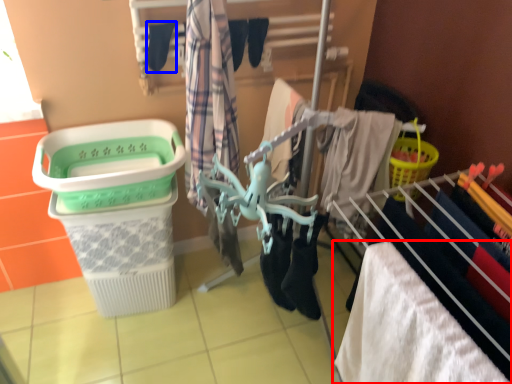
Question: Which object appears closest to the camera in this image, towel (highlighted by a red box) or clothing (highlighted by a blue box)?

Choices:
 (A) towel
 (B) clothing

Answer: (A)